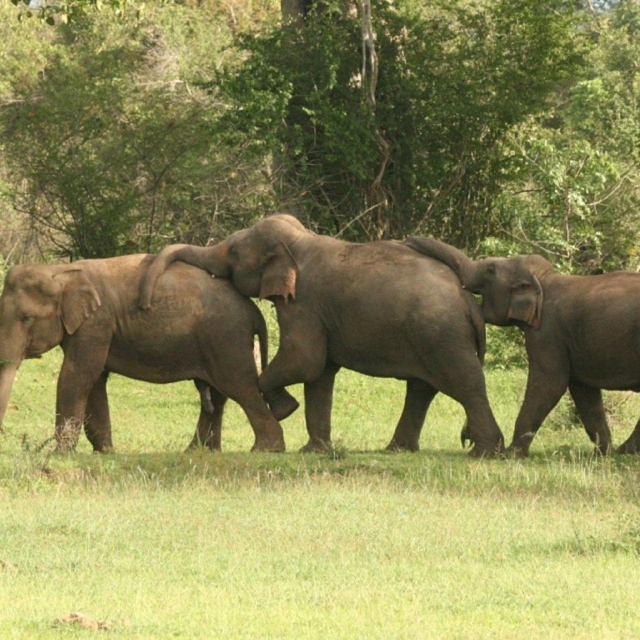
You are a wildlife photographer trying to capture a photo of the gray matte elephant legs at center and the gray textured baby elephant at center. Since you want to ensure both are in focus, you need to know their sizes. Which one is larger?

The gray matte elephant legs at center is bigger than the gray textured baby elephant at center, so you should adjust your camera settings to accommodate the larger size for better focus.

You are a wildlife photographer observing the elephants. You notice the gray matte elephant at center and the gray textured baby elephant at center. Which one has a smaller size?

The gray matte elephant at center is smaller than the gray textured baby elephant at center.

You are a wildlife photographer aiming to capture a photo of the gray textured baby elephant at center and the gray textured elephant at center. Based on their widths, which one should you focus on to ensure the photo includes the entire subject without cropping?

The gray textured baby elephant at center might be wider than the gray textured elephant at center, so focusing on the baby elephant ensures the entire subject fits without cropping.